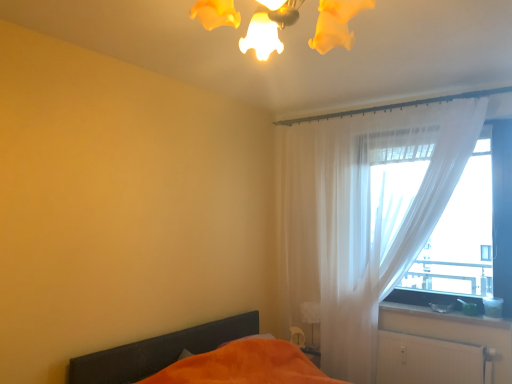
In order to click on free space above white textured radiator at lower right (from a real-world perspective) in this screenshot , I will do `click(435, 336)`.